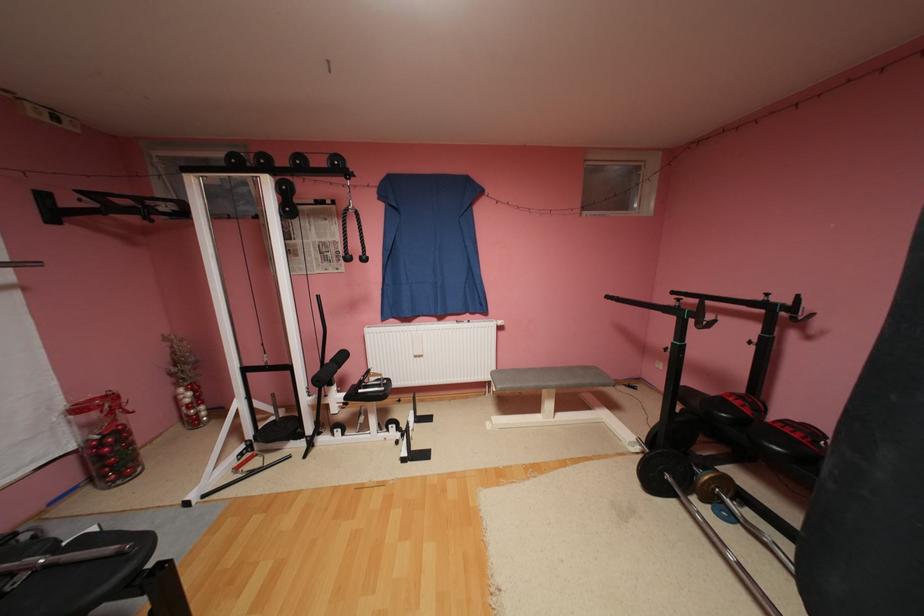
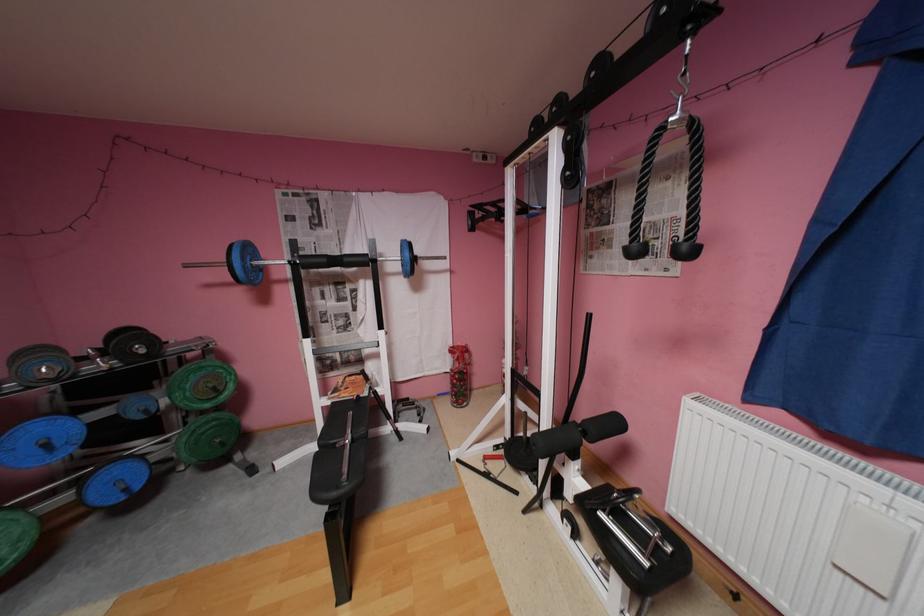
Locate, in the second image, the point that corresponds to (372,257) in the first image.

(695, 246)